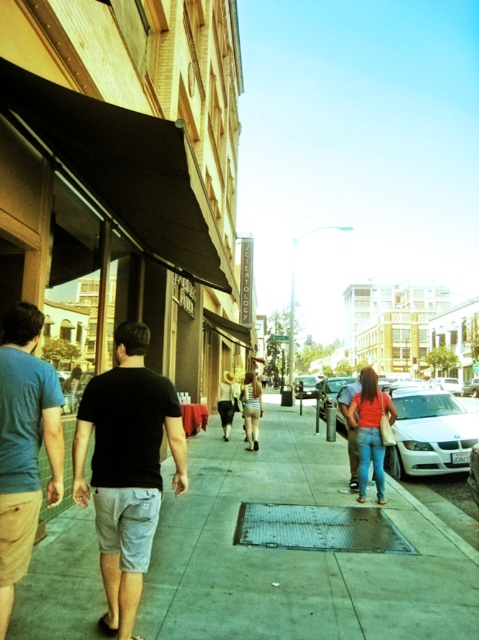
From the picture: You are standing on the sidewalk looking down the street. There is a white glossy sedan at center. If you were to walk straight ahead, would the sedan be in your path?

The white glossy sedan at center is positioned at point (430,433), which is along the central axis of the street. If you walk straight ahead, you would be moving along this central axis, so the sedan would indeed be in your path. You would need to navigate around it or wait for it to move.